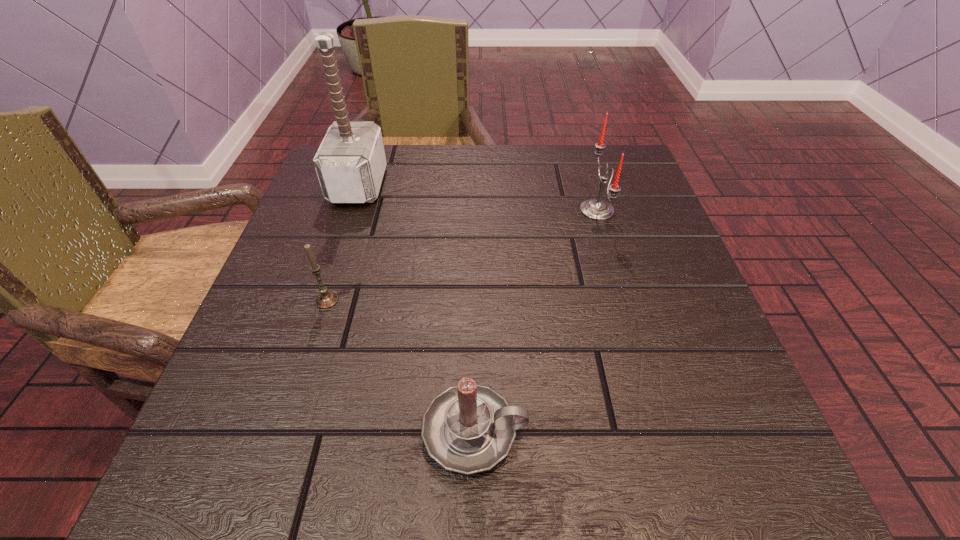
In order to click on free space located 0.200m on the front-facing side of the rightmost candle in this screenshot , I will do `click(484, 210)`.

Find the location of a particular element. This screenshot has width=960, height=540. blank space located 0.090m on the left of the third farthest object is located at coordinates (262, 300).

Where is `vacant space located on the side of the second candle from right to left with the handle loop`? This screenshot has width=960, height=540. vacant space located on the side of the second candle from right to left with the handle loop is located at coordinates (572, 431).

Locate an element on the screen. hammer present at the far edge is located at coordinates (350, 163).

Image resolution: width=960 pixels, height=540 pixels. Identify the location of candle that is at the far edge. (596, 209).

Image resolution: width=960 pixels, height=540 pixels. What are the coordinates of `object that is at the near edge` in the screenshot? It's located at (469, 428).

Where is `hammer located in the left edge section of the desktop`? hammer located in the left edge section of the desktop is located at coordinates (350, 163).

Image resolution: width=960 pixels, height=540 pixels. Find the location of `candle that is at the left edge`. candle that is at the left edge is located at coordinates (326, 299).

Identify the location of object that is positioned at the right edge. Image resolution: width=960 pixels, height=540 pixels. (596, 209).

This screenshot has height=540, width=960. I want to click on object located in the far left corner section of the desktop, so click(x=350, y=163).